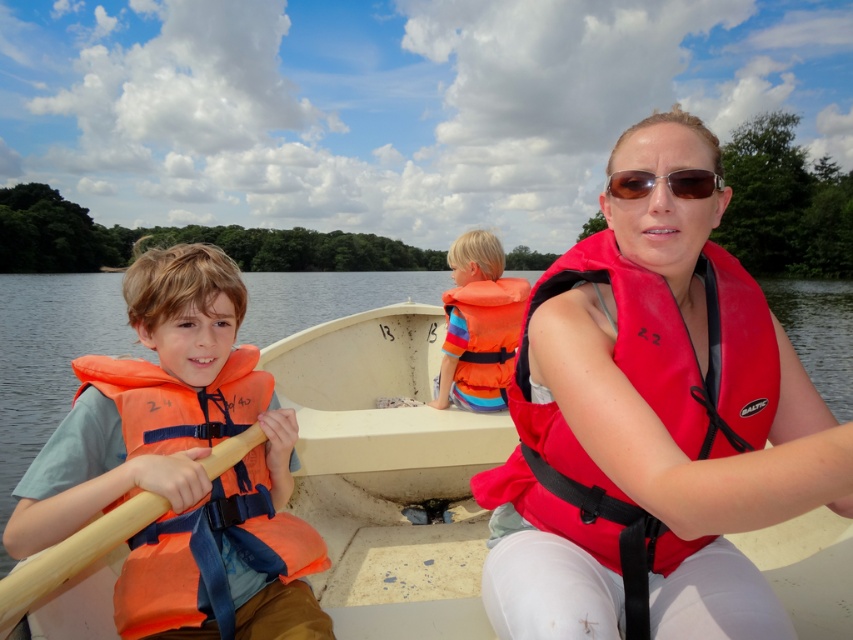
You are a photographer on a boat and want to take a photo of the wooden paddle at center and the matte brown sunglasses at center. Since you have a limited space in your camera frame, which object should you focus on to ensure it fits entirely within the frame?

The wooden paddle at center is larger in size than the matte brown sunglasses at center, so you should focus on capturing the wooden paddle at center to ensure it fits entirely within the frame.

You are a photographer standing on the boat and want to take a photo of the wooden paddle at center and the matte brown sunglasses at center. Which object should you focus on first if you want to capture both in sharp focus?

The wooden paddle at center is closer to the viewer than the matte brown sunglasses at center, so you should focus on the wooden paddle at center first to ensure both are in sharp focus.

You are on a boat and need to grab the wooden paddle at center and the matte brown sunglasses at center. Which object is closer to your right hand if you are facing forward?

The matte brown sunglasses at center is closer to your right hand because the wooden paddle at center is to the left of it.